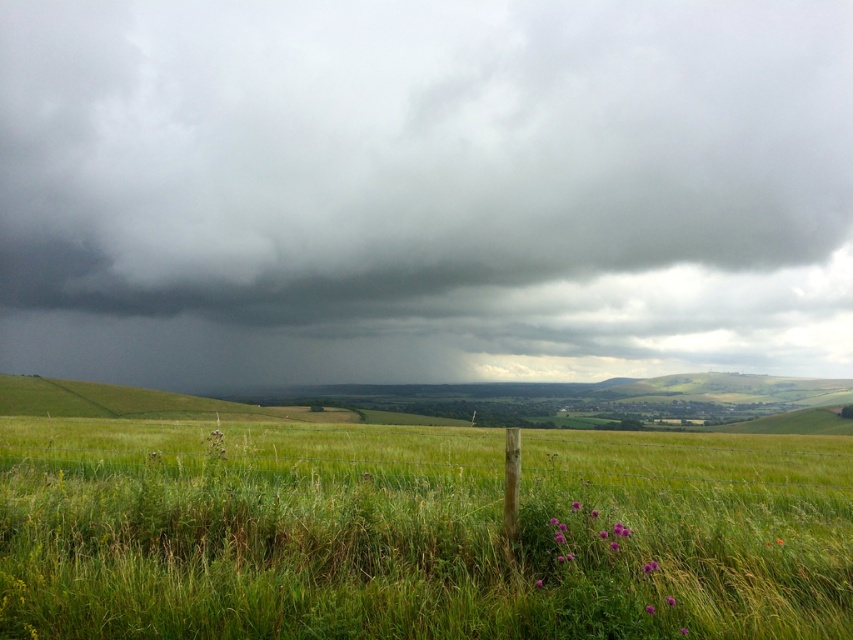
Question: Among these points, which one is nearest to the camera?

Choices:
 (A) (398, 484)
 (B) (566, 140)

Answer: (A)

Question: Which of the following is the farthest from the observer?

Choices:
 (A) dark gray cloud at upper center
 (B) green grassy field at lower center

Answer: (A)

Question: Does dark gray cloud at upper center come behind green grassy field at lower center?

Choices:
 (A) no
 (B) yes

Answer: (B)

Question: Does dark gray cloud at upper center have a larger size compared to green grassy field at lower center?

Choices:
 (A) no
 (B) yes

Answer: (B)

Question: Is dark gray cloud at upper center wider than green grassy field at lower center?

Choices:
 (A) yes
 (B) no

Answer: (A)